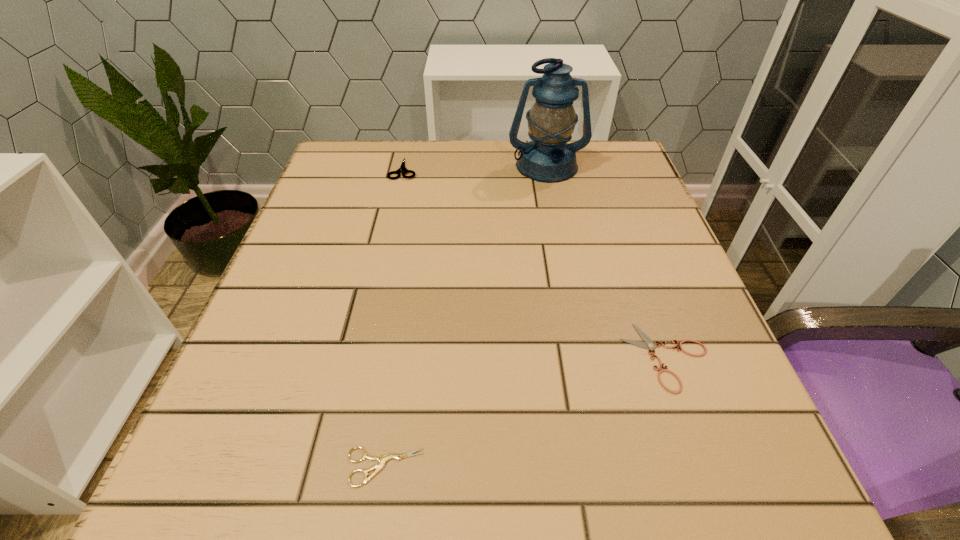
Identify the location of lantern situated at the far edge. pos(548,158).

Identify the location of shears located in the far edge section of the desktop. (402, 168).

At what (x,y) coordinates should I click in order to perform the action: click on object that is at the near edge. Please return your answer as a coordinate pair (x, y). This screenshot has width=960, height=540. Looking at the image, I should click on click(382, 459).

In order to click on object that is at the left edge in this screenshot , I will do `click(402, 168)`.

Find the location of `lantern positioned at the right edge`. lantern positioned at the right edge is located at coordinates (548, 158).

Locate an element on the screen. Image resolution: width=960 pixels, height=540 pixels. shears that is at the right edge is located at coordinates (648, 343).

Find the location of a particular element. object situated at the far left corner is located at coordinates click(402, 168).

I want to click on object that is positioned at the far right corner, so click(x=548, y=158).

Where is `vacant space at the far edge of the desktop`? vacant space at the far edge of the desktop is located at coordinates (440, 158).

You are a GUI agent. You are given a task and a screenshot of the screen. Output one action in this format:
    pyautogui.click(x=<x>, y=<y>)
    Task: Click on the vacant region at the near edge of the desktop
    The width and height of the screenshot is (960, 540).
    Given the screenshot: What is the action you would take?
    pyautogui.click(x=487, y=509)